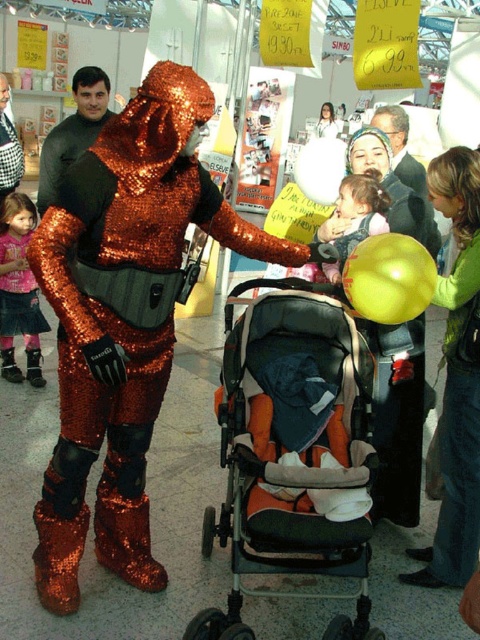
Question: Which object is closer to the camera taking this photo?

Choices:
 (A) orange fabric baby carriage at center
 (B) matte black jacket at upper right

Answer: (A)

Question: Which of the following is the farthest from the observer?

Choices:
 (A) (360, 234)
 (B) (263, 193)
 (C) (32, 280)

Answer: (B)

Question: In this image, where is matte pink shirt at lower left located relative to matte black jacket at upper right?

Choices:
 (A) left
 (B) right

Answer: (A)

Question: Which point is closer to the camera?

Choices:
 (A) (407, 122)
 (B) (313, 173)

Answer: (A)

Question: Considering the relative positions of yellow rubber balloon at right and black matte shirt at center in the image provided, where is yellow rubber balloon at right located with respect to black matte shirt at center?

Choices:
 (A) right
 (B) left

Answer: (A)

Question: Does yellow rubber balloon at right appear on the right side of shiny metallic costume at center?

Choices:
 (A) no
 (B) yes

Answer: (B)